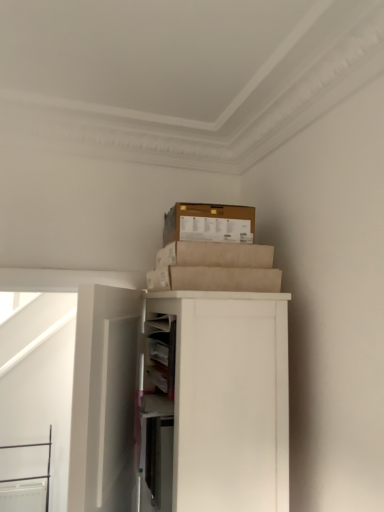
Question: Is point (125, 454) closer or farther from the camera than point (148, 426)?

Choices:
 (A) farther
 (B) closer

Answer: (A)

Question: Is white matte door at left in front of or behind white matte cabinet at upper right in the image?

Choices:
 (A) behind
 (B) front

Answer: (B)

Question: Estimate the real-world distances between objects in this image. Which object is closer to the white matte door at left?

Choices:
 (A) white matte cabinet at upper right
 (B) brown cardboard box at upper center

Answer: (A)

Question: Considering the real-world distances, which object is closest to the white matte door at left?

Choices:
 (A) brown cardboard box at upper center
 (B) white matte cabinet at upper right

Answer: (B)